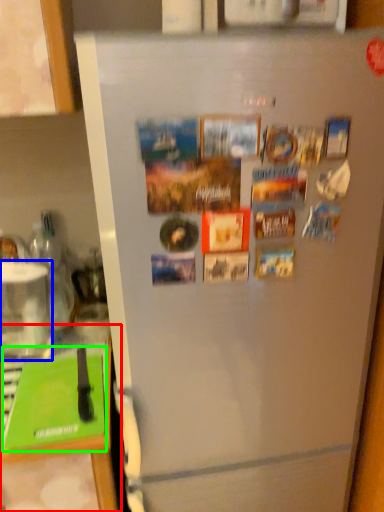
Question: Which object is the farthest from counter top (highlighted by a red box)? Choose among these: appliance (highlighted by a blue box) or magazine (highlighted by a green box).

Choices:
 (A) appliance
 (B) magazine

Answer: (A)